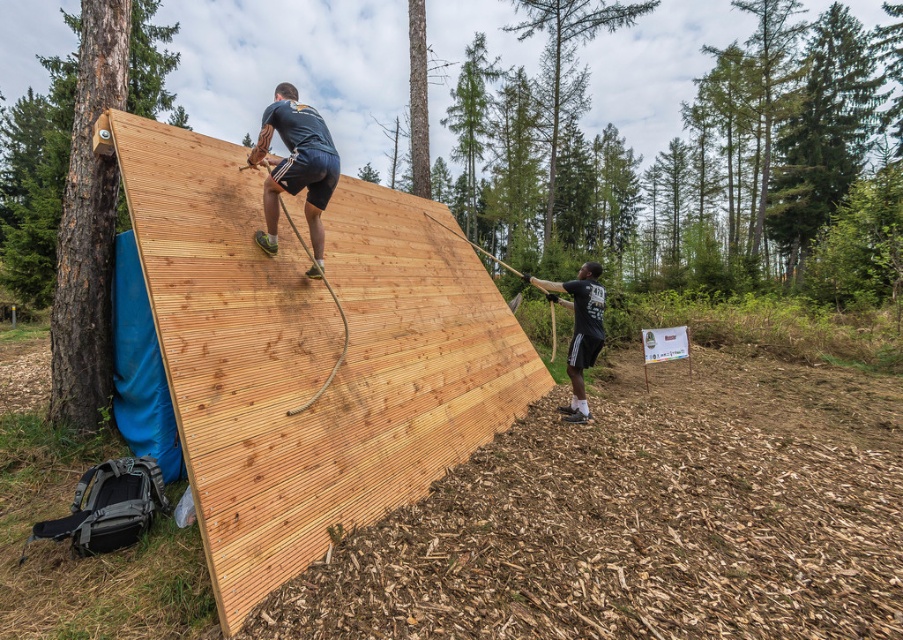
Based on the scene, can you determine if the natural wood plywood at upper center is wider than the dark blue fabric at upper center?

The natural wood plywood at upper center is wider than the dark blue fabric at upper center according to the description.

You are organizing an outdoor event and need to ensure safety. Given the natural wood plywood at upper center and the black matte shirt at right, which object should you focus on securing to prevent slipping, and why?

The natural wood plywood at upper center should be focused on securing because it is larger in size than the black matte shirt at right, making it a more critical surface for safety during climbing activities.